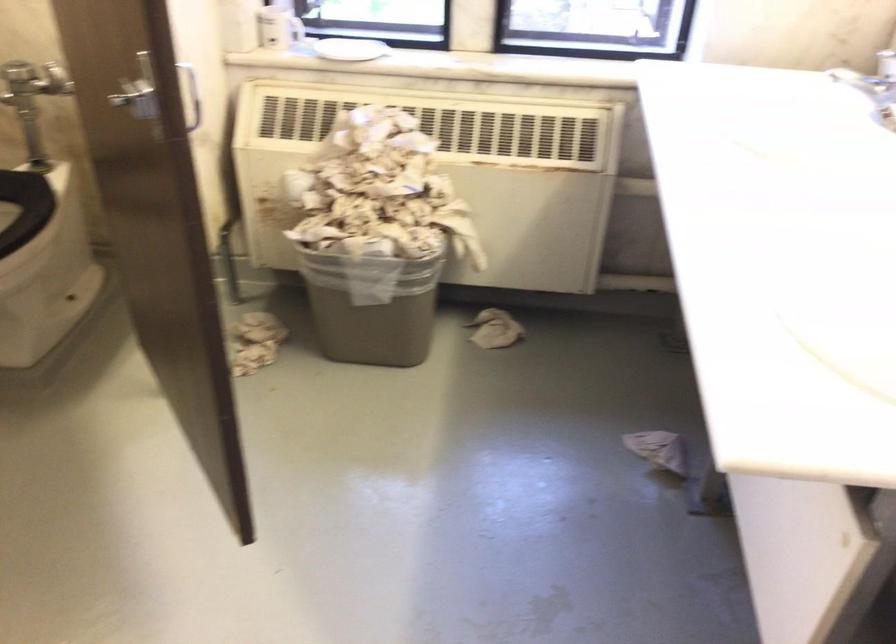
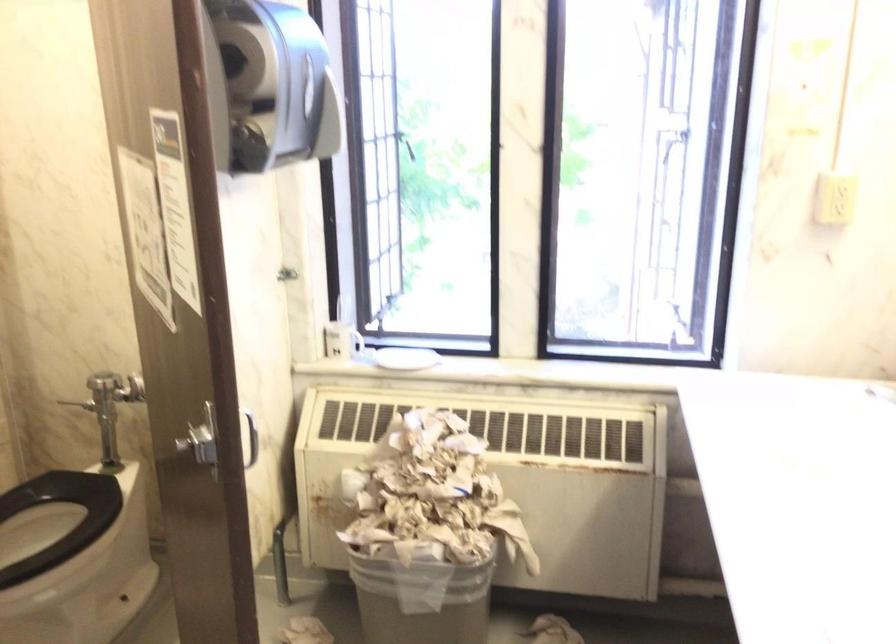
Question: Based on the continuous images, in which direction is the camera rotating? Reply with the corresponding letter.

Choices:
 (A) Left
 (B) Right
 (C) Up
 (D) Down

Answer: (C)